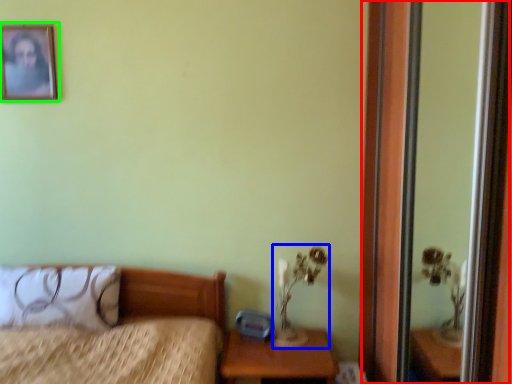
Question: Which is nearer to the screen door (highlighted by a red box)? table lamp (highlighted by a blue box) or picture frame (highlighted by a green box).

Choices:
 (A) table lamp
 (B) picture frame

Answer: (A)